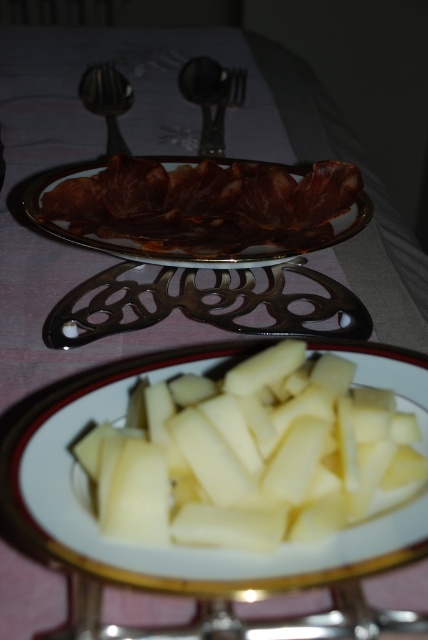
Is matte brown plate at center further to the viewer compared to shiny silver spoon at upper left?

No, matte brown plate at center is closer to the viewer.

Is matte brown plate at center positioned before shiny silver spoon at upper left?

Yes.

Is point (83, 220) positioned behind point (121, 77)?

No.

This screenshot has height=640, width=428. Find the location of `matte brown plate at center`. matte brown plate at center is located at coordinates (201, 209).

Can you confirm if white glossy plate at center is positioned to the right of polished metal spoon at upper center?

Yes, white glossy plate at center is to the right of polished metal spoon at upper center.

Who is more forward, [353,531] or [187,97]?

Point [353,531]

The image size is (428, 640). Find the location of `white glossy plate at center`. white glossy plate at center is located at coordinates (228, 467).

Can you confirm if white glossy plate at center is positioned to the right of matte brown plate at center?

Correct, you'll find white glossy plate at center to the right of matte brown plate at center.

Is white glossy plate at center above matte brown plate at center?

Actually, white glossy plate at center is below matte brown plate at center.

Describe the element at coordinates (228, 467) in the screenshot. The image size is (428, 640). I see `white glossy plate at center` at that location.

Find the location of `white glossy plate at center`. white glossy plate at center is located at coordinates (228, 467).